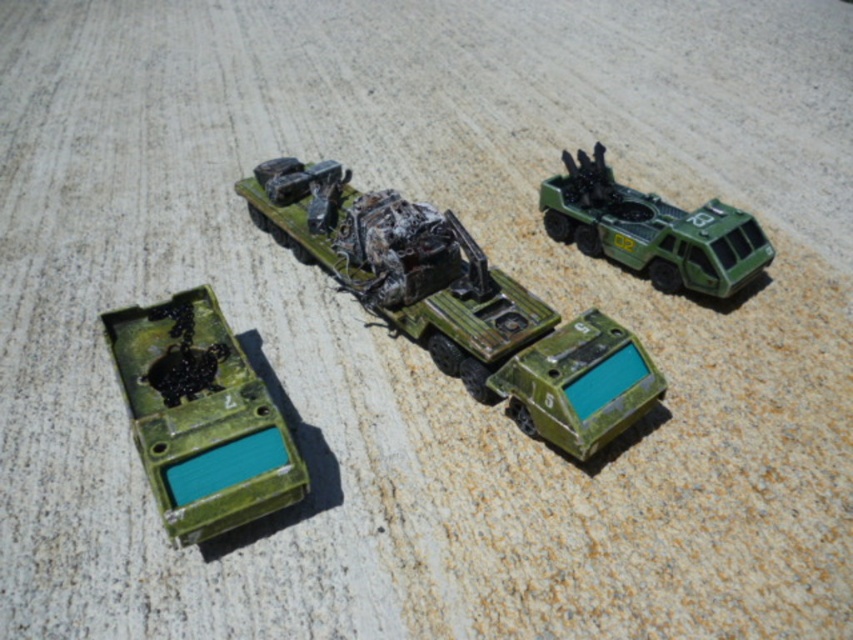
Question: Which of the following is the farthest from the observer?

Choices:
 (A) matte green plastic tank at lower center
 (B) matte green truck at center
 (C) matte green plastic at lower left

Answer: (B)

Question: Which object is the closest to the matte green truck at center?

Choices:
 (A) green matte military vehicle at upper right
 (B) matte green plastic at lower left
 (C) matte green plastic tank at lower center

Answer: (C)

Question: Which of the following is the farthest from the observer?

Choices:
 (A) matte green plastic at lower left
 (B) matte green plastic tank at lower center

Answer: (B)

Question: Can you confirm if matte green truck at center is smaller than matte green plastic tank at lower center?

Choices:
 (A) no
 (B) yes

Answer: (A)

Question: Does matte green truck at center appear on the right side of matte green plastic at lower left?

Choices:
 (A) yes
 (B) no

Answer: (A)

Question: Does matte green truck at center lie behind green matte military vehicle at upper right?

Choices:
 (A) no
 (B) yes

Answer: (A)